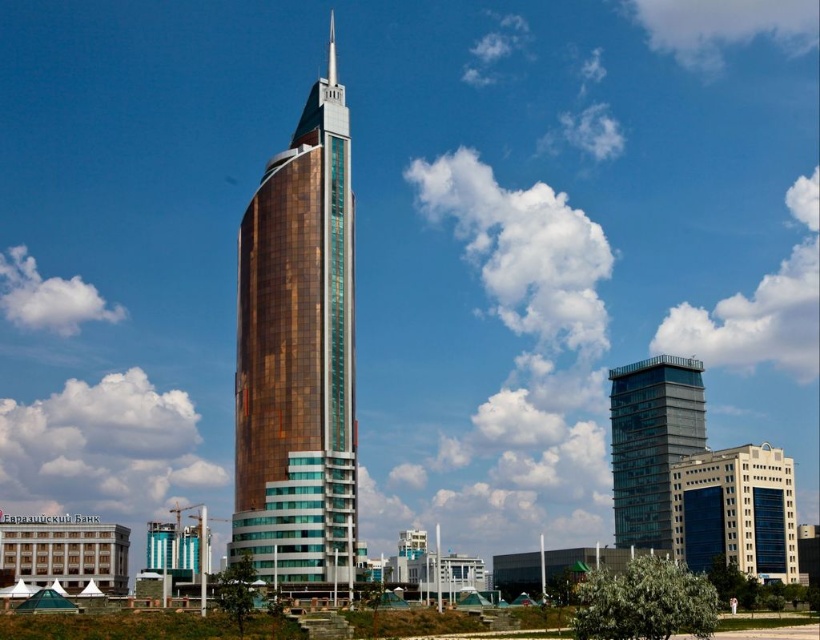
Question: Does gold reflective glass tower at center have a greater width compared to transparent glass building at center?

Choices:
 (A) yes
 (B) no

Answer: (A)

Question: Considering the real-world distances, which object is farthest from the transparent glass building at center?

Choices:
 (A) gold reflective glass tower at center
 (B) white glass building at lower right

Answer: (A)

Question: Which point is farther from the camera taking this photo?

Choices:
 (A) (713, 497)
 (B) (684, 397)
 (C) (331, 179)

Answer: (B)

Question: Is gold reflective glass tower at center wider than transparent glass building at center?

Choices:
 (A) no
 (B) yes

Answer: (B)

Question: From the image, what is the correct spatial relationship of gold reflective glass tower at center in relation to white glass building at lower right?

Choices:
 (A) below
 (B) above

Answer: (B)

Question: Which of the following is the closest to the observer?

Choices:
 (A) (269, 177)
 (B) (732, 557)
 (C) (609, 420)

Answer: (A)